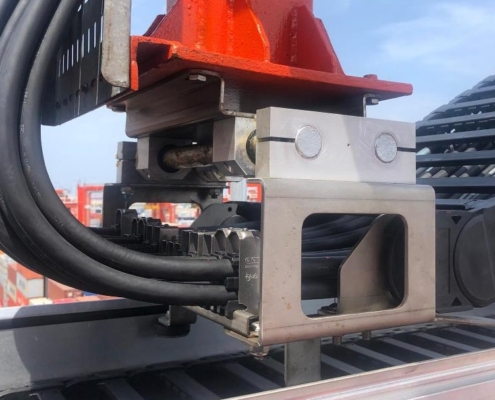
The width and height of the screenshot is (495, 400). Find the location of `black slats`. black slats is located at coordinates (125, 390), (188, 378), (248, 372), (269, 363), (341, 368), (370, 355), (417, 344), (473, 335), (442, 340).